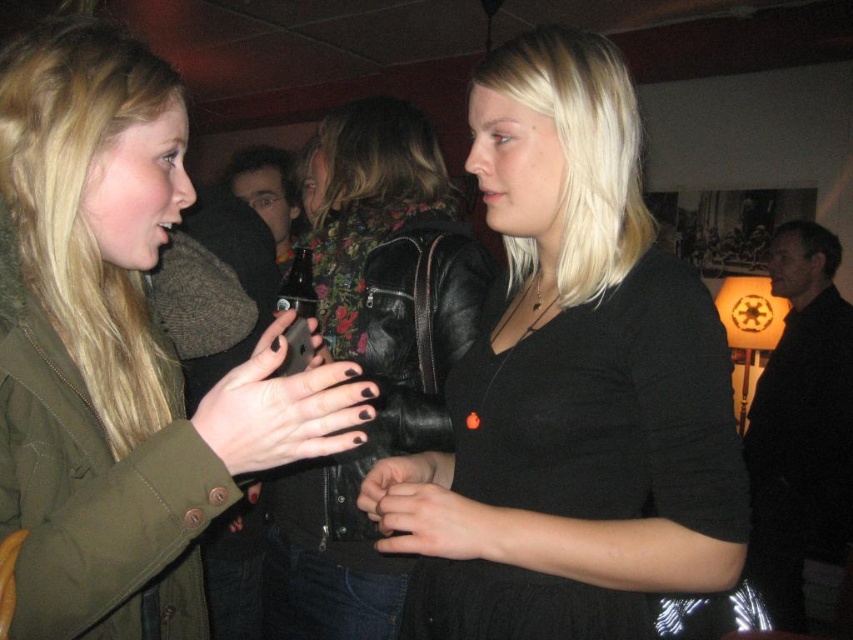
Question: Does leather jacket at center have a larger size compared to matte black phone at center?

Choices:
 (A) yes
 (B) no

Answer: (A)

Question: Can you confirm if black matte phone at center is bigger than smooth black hand at center?

Choices:
 (A) yes
 (B) no

Answer: (A)

Question: Which point is closer to the camera?

Choices:
 (A) (294, 321)
 (B) (430, 476)
 (C) (135, 323)
 (D) (479, 547)

Answer: (D)

Question: Which object is the closest to the leather jacket at center?

Choices:
 (A) matte black phone at center
 (B) black matte phone at center
 (C) black matte shirt at center

Answer: (A)

Question: Which point appears farthest from the camera in this image?

Choices:
 (A) (300, 369)
 (B) (438, 460)
 (C) (553, 84)
 (D) (71, 170)

Answer: (B)

Question: Is smooth black hand at center thinner than matte black phone at center?

Choices:
 (A) no
 (B) yes

Answer: (A)